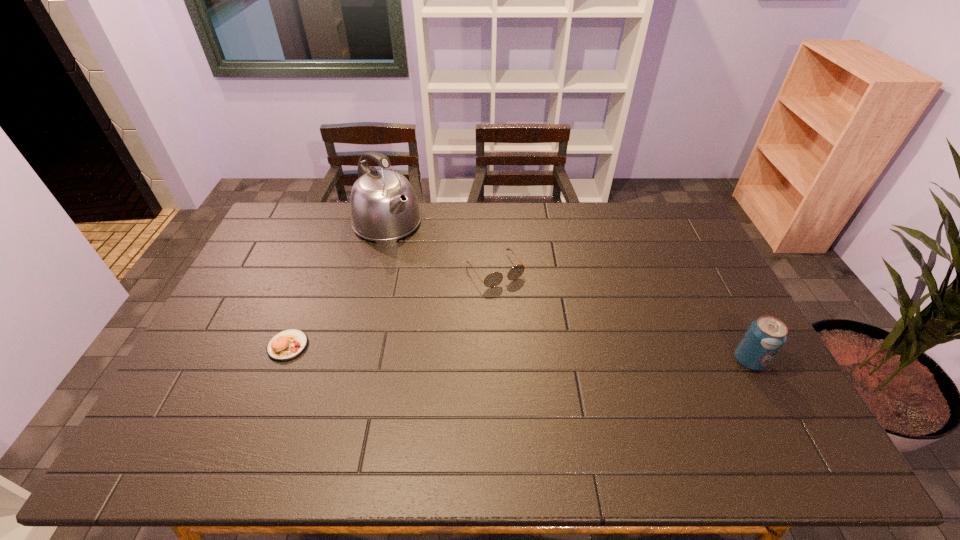
What are the coordinates of `the shortest object` in the screenshot? It's located at (286, 345).

Identify the location of the leftmost object. Image resolution: width=960 pixels, height=540 pixels. (286, 345).

Find the location of `pop soda`. pop soda is located at coordinates (765, 336).

Locate an element on the screen. the third shortest object is located at coordinates (765, 336).

The image size is (960, 540). I want to click on the farthest object, so click(383, 206).

This screenshot has height=540, width=960. I want to click on kettle, so click(383, 206).

Image resolution: width=960 pixels, height=540 pixels. In order to click on the second object from right to left in this screenshot , I will do `click(493, 279)`.

This screenshot has width=960, height=540. I want to click on the second farthest object, so click(493, 279).

Identify the location of vacant point located on the left of the leftmost object. This screenshot has width=960, height=540. (207, 346).

You are a GUI agent. You are given a task and a screenshot of the screen. Output one action in this format:
    pyautogui.click(x=<x>, y=<y>)
    Task: Click on the vacant space located 0.340m on the back of the pop soda
    
    Given the screenshot: What is the action you would take?
    pyautogui.click(x=699, y=266)